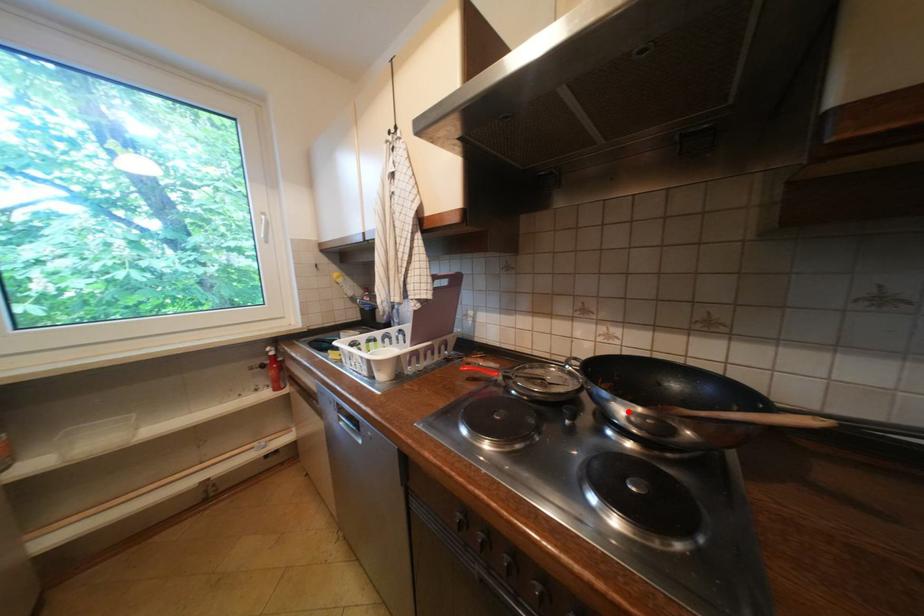
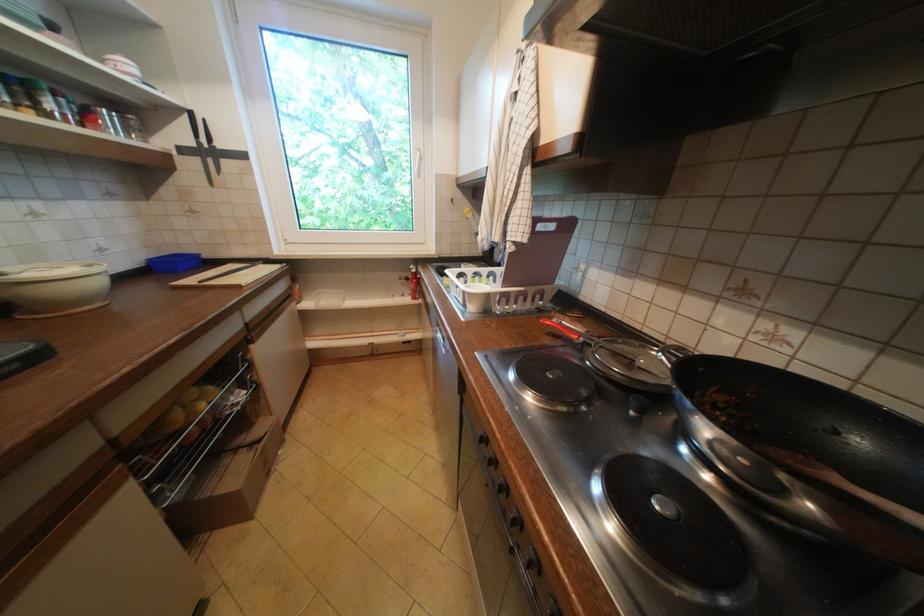
The point at the highlighted location is marked in the first image. Where is the corresponding point in the second image?

(715, 430)